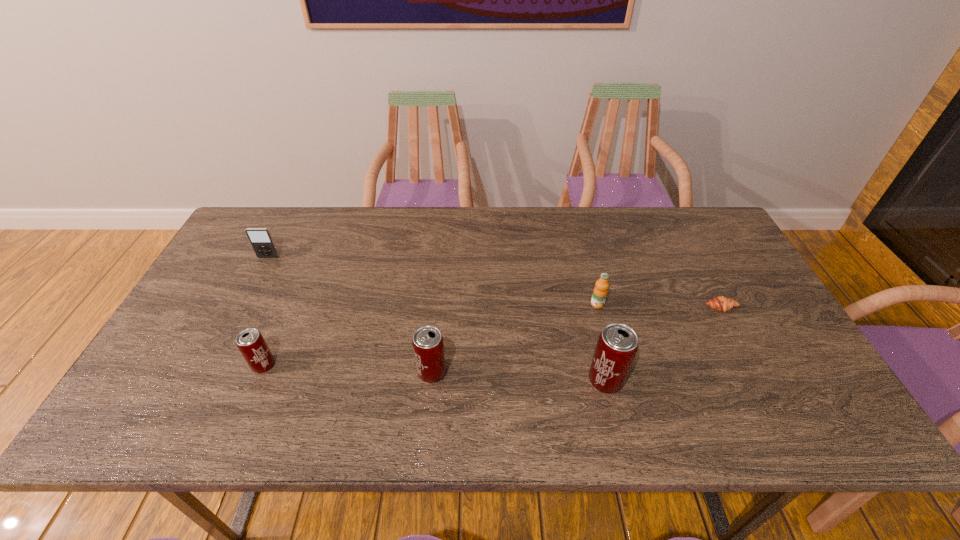
You are a GUI agent. You are given a task and a screenshot of the screen. Output one action in this format:
    pyautogui.click(x=<x>, y=<y>)
    Task: Click on the leftmost beer can
    Image resolution: width=960 pixels, height=540 pixels.
    Given the screenshot: What is the action you would take?
    pyautogui.click(x=250, y=342)

Where is `the shortest beer can`? the shortest beer can is located at coordinates (250, 342).

The width and height of the screenshot is (960, 540). I want to click on the fourth object from right to left, so click(x=428, y=345).

This screenshot has width=960, height=540. I want to click on the second beer can from left to right, so click(x=428, y=345).

Where is `the tallest beer can`? This screenshot has width=960, height=540. the tallest beer can is located at coordinates (617, 345).

You are a GUI agent. You are given a task and a screenshot of the screen. Output one action in this format:
    pyautogui.click(x=<x>, y=<y>)
    Task: Click on the rightmost beer can
    This screenshot has height=540, width=960.
    Given the screenshot: What is the action you would take?
    pyautogui.click(x=617, y=345)

The image size is (960, 540). I want to click on iPod, so click(261, 240).

Identify the location of the farthest object. click(x=261, y=240).

You are a GUI agent. You are given a task and a screenshot of the screen. Output one action in this format:
    pyautogui.click(x=<x>, y=<y>)
    Task: Click on the rightmost object
    Image resolution: width=960 pixels, height=540 pixels.
    Given the screenshot: What is the action you would take?
    coord(721,303)

Find the location of a particular element. pastry is located at coordinates (721, 303).